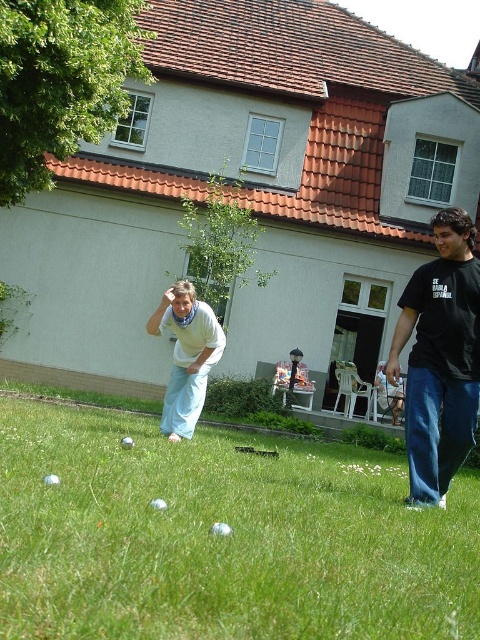
Which is behind, point (424, 512) or point (421, 376)?

Point (421, 376)

Which is in front, point (352, 493) or point (456, 317)?

Point (456, 317) is in front.

I want to click on green grass at center, so click(220, 538).

Does green grass at center appear over light blue fabric at center?

Incorrect, green grass at center is not positioned above light blue fabric at center.

Find the location of a particular element. green grass at center is located at coordinates (220, 538).

Can you confirm if black cotton t-shirt at right is smaller than light blue fabric at center?

Yes.

Which is below, black cotton t-shirt at right or light blue fabric at center?

light blue fabric at center is below.

Who is more forward, (x=431, y=458) or (x=201, y=372)?

Point (x=431, y=458)

The width and height of the screenshot is (480, 640). I want to click on black cotton t-shirt at right, so click(x=440, y=358).